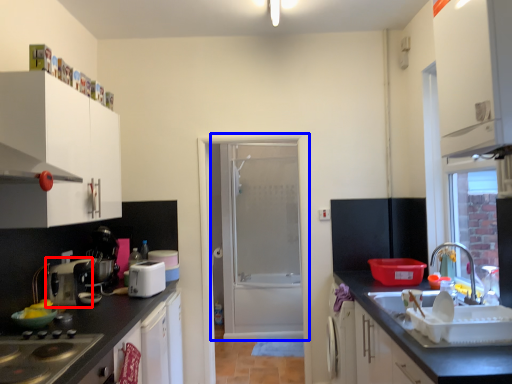
Question: Among these objects, which one is farthest to the camera, appliance (highlighted by a red box) or door (highlighted by a blue box)?

Choices:
 (A) appliance
 (B) door

Answer: (B)